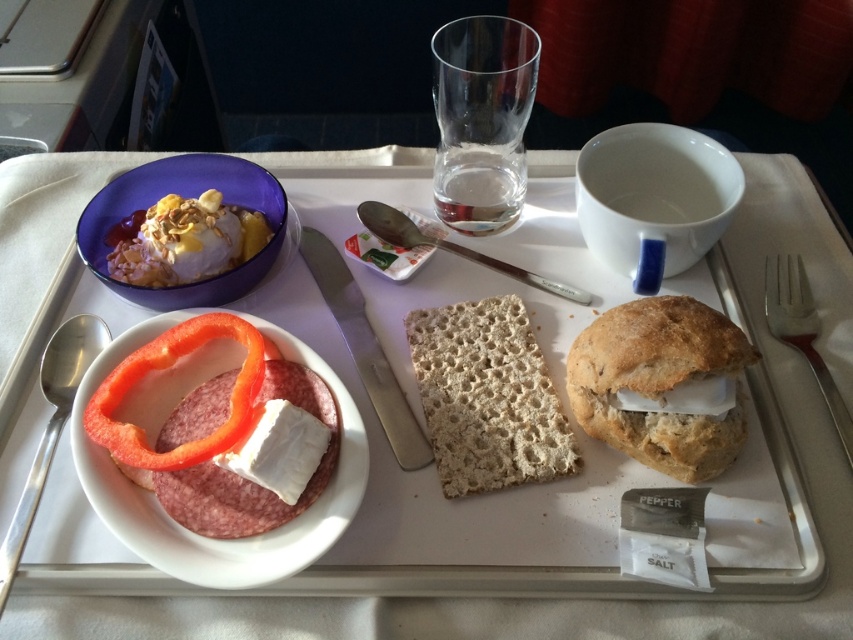
Question: Which object appears farthest from the camera in this image?

Choices:
 (A) red smooth pepper at lower left
 (B) breadcrustysandwich at right
 (C) white crumbly bread at center

Answer: (B)

Question: Among these points, which one is farthest from the camera?

Choices:
 (A) (700, 316)
 (B) (238, 250)

Answer: (B)

Question: Is white matte bowl at center-left above red smooth pepper at lower left?

Choices:
 (A) yes
 (B) no

Answer: (B)

Question: Can you confirm if bread at center is positioned to the right of red smooth pepper at lower left?

Choices:
 (A) no
 (B) yes

Answer: (B)

Question: Among these objects, which one is nearest to the camera?

Choices:
 (A) bread at center
 (B) red smooth pepper at lower left

Answer: (B)

Question: Is white crumbly bread at center above smooth vanilla ice cream at upper left?

Choices:
 (A) yes
 (B) no

Answer: (B)